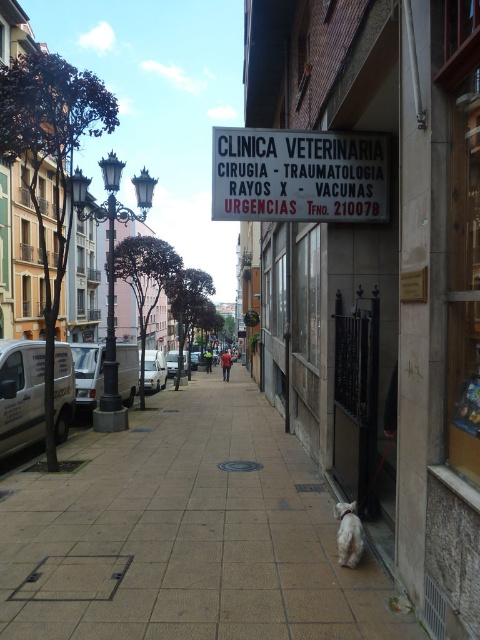
Is brown tile pavement at center below white fluffy dog at lower center?

Yes, brown tile pavement at center is below white fluffy dog at lower center.

Describe the element at coordinates (186, 534) in the screenshot. I see `brown tile pavement at center` at that location.

Identify the location of brown tile pavement at center. The height and width of the screenshot is (640, 480). (186, 534).

Describe the element at coordinates (186, 534) in the screenshot. I see `brown tile pavement at center` at that location.

Between brown tile pavement at center and white matte van at center, which one is positioned lower?

Positioned lower is brown tile pavement at center.

Is point (60, 632) behind point (164, 356)?

No, it is in front of (164, 356).

I want to click on brown tile pavement at center, so click(186, 534).

Is white paper sign at center to the right of metallic silver van at left from the viewer's perspective?

Yes, white paper sign at center is to the right of metallic silver van at left.

Can you confirm if white paper sign at center is smaller than metallic silver van at left?

Yes.

Image resolution: width=480 pixels, height=640 pixels. In order to click on white paper sign at center in this screenshot , I will do `click(299, 176)`.

Identify the location of white paper sign at center. The width and height of the screenshot is (480, 640). (299, 176).